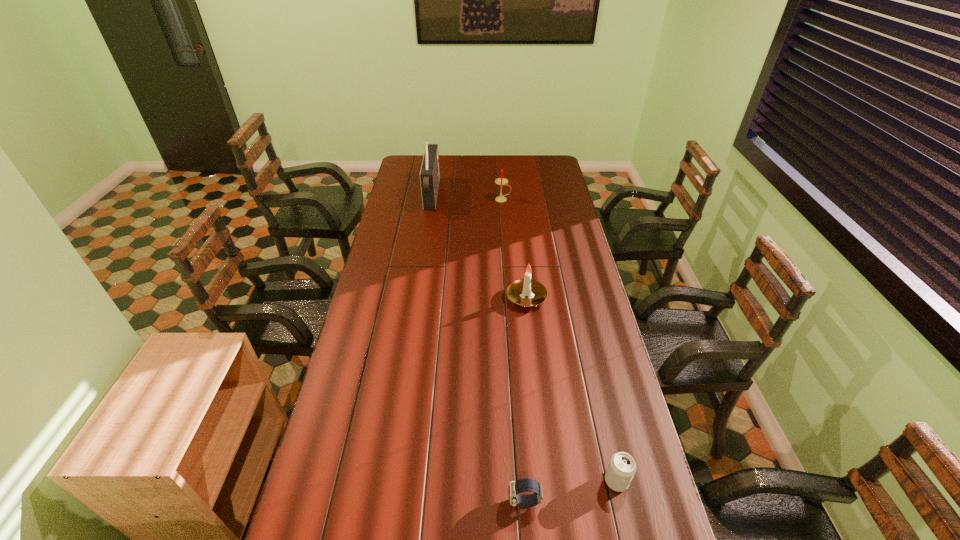
This screenshot has height=540, width=960. What are the coordinates of `free space in the image that satisfies the following two spatial constraints: 1. on the front side of the farther candle; 2. on the left side of the third nearest object` in the screenshot? It's located at (510, 298).

Locate an element on the screen. free space that satisfies the following two spatial constraints: 1. on the front side of the nearer candle; 2. on the face of the watch is located at coordinates (549, 502).

The height and width of the screenshot is (540, 960). I want to click on free space that satisfies the following two spatial constraints: 1. on the front panel of the tallest object; 2. on the back side of the farther candle, so click(432, 199).

The image size is (960, 540). What are the coordinates of `free space that satisfies the following two spatial constraints: 1. on the front side of the farther candle; 2. on the right side of the can` in the screenshot? It's located at (523, 481).

At what (x,y) coordinates should I click in order to perform the action: click on free region that satisfies the following two spatial constraints: 1. on the front side of the farther candle; 2. on the left side of the nearer candle. Please return your answer as a coordinate pair (x, y). The image size is (960, 540). Looking at the image, I should click on (510, 298).

Find the location of a particular element. free space in the image that satisfies the following two spatial constraints: 1. on the front panel of the tallest object; 2. on the left side of the can is located at coordinates (388, 481).